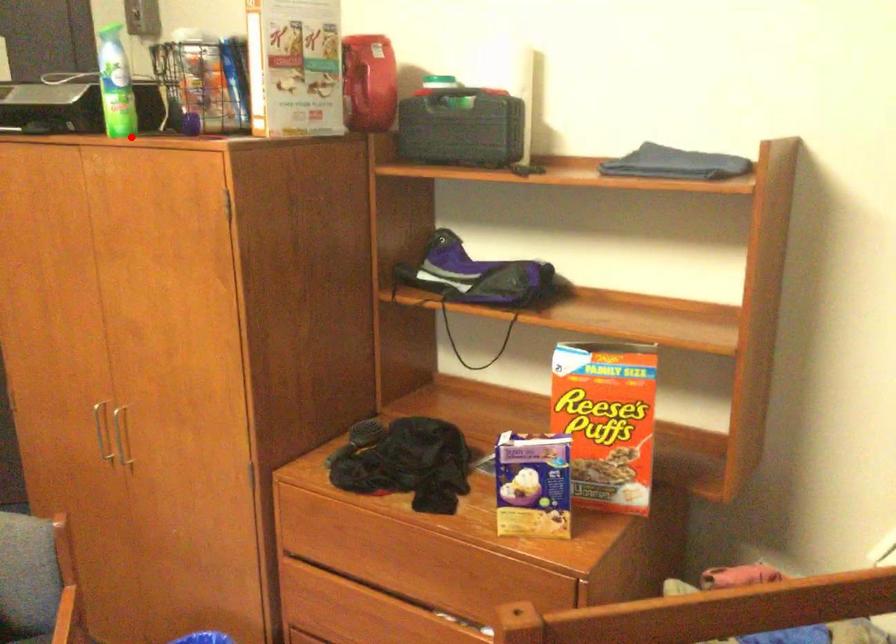
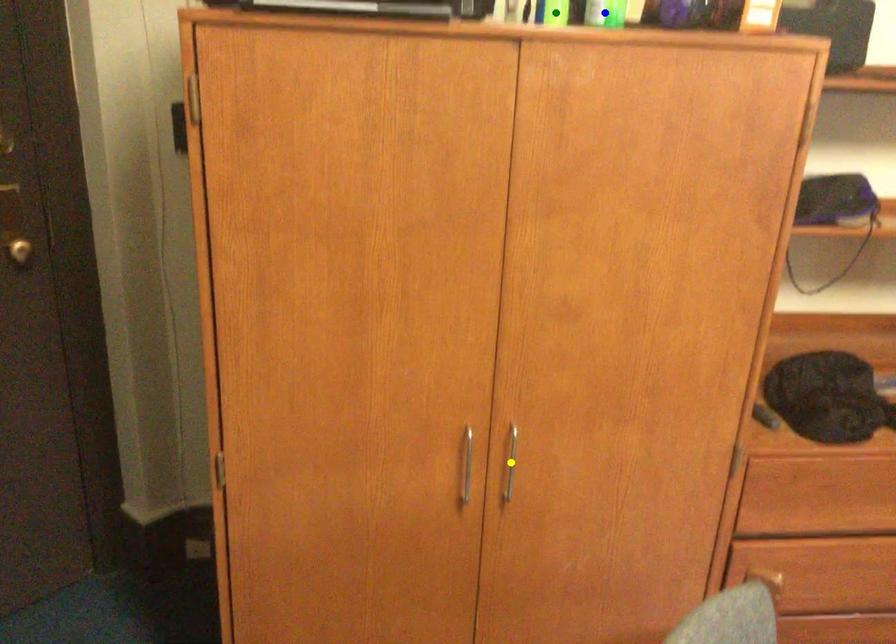
Question: I am providing you with two images of the same scene from different viewpoints. A red point is marked on the first image. You are given multiple points on the second image. Which point in image 2 represents the same 3d spot as the red point in image 1?

Choices:
 (A) yellow point
 (B) green point
 (C) blue point

Answer: (C)